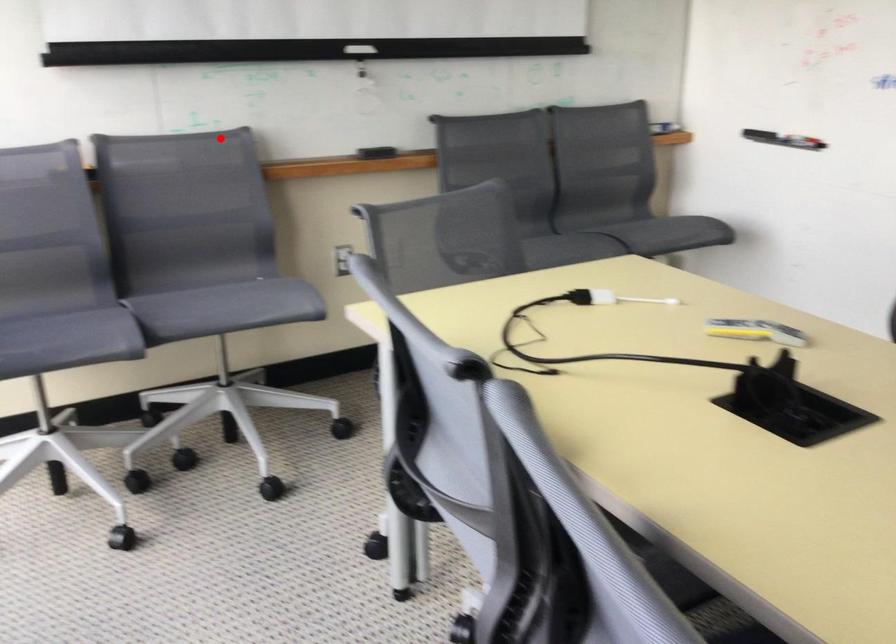
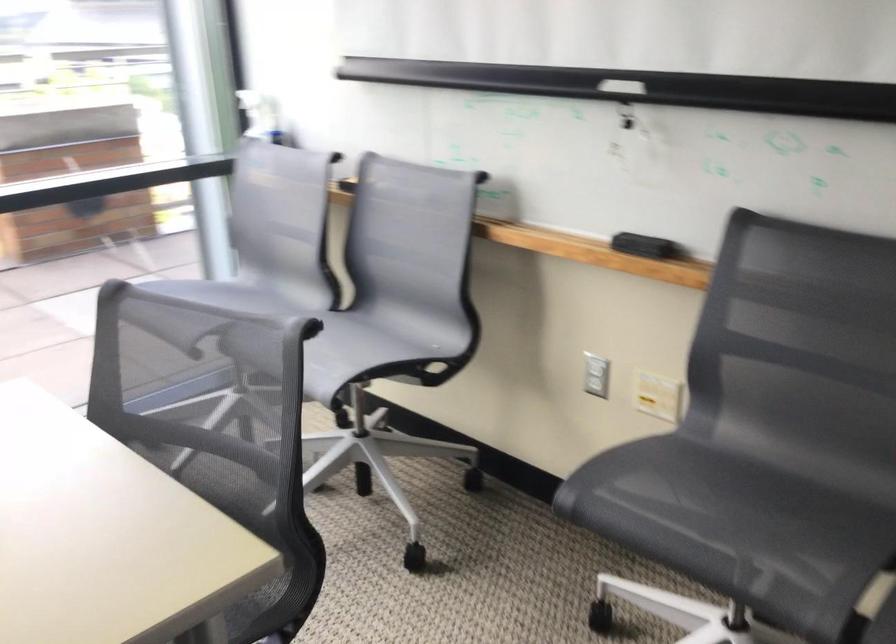
The point at the highlighted location is marked in the first image. Where is the corresponding point in the second image?

(457, 182)